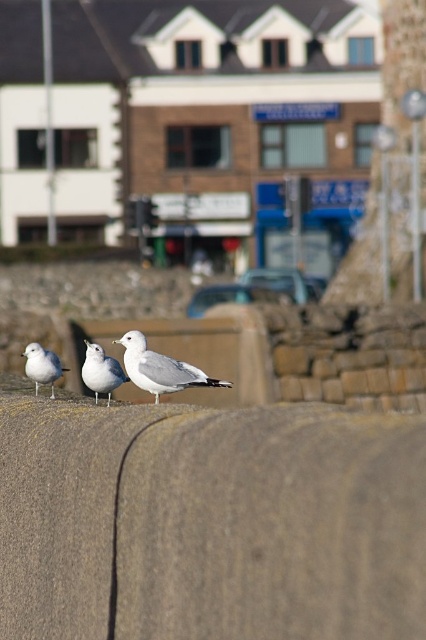
Question: Is white matte seagull at center above white matte seagull at left?

Choices:
 (A) yes
 (B) no

Answer: (A)

Question: Estimate the real-world distances between objects in this image. Which object is closer to the white matte seagull at center?

Choices:
 (A) white feathered seagull at center
 (B) white matte seagull at left

Answer: (A)

Question: Which point is closer to the camera?

Choices:
 (A) (227, 412)
 (B) (146, 388)

Answer: (A)

Question: Can you confirm if gray concrete wall at center is bigger than white feathered seagull at center?

Choices:
 (A) yes
 (B) no

Answer: (A)

Question: Which object appears closest to the camera in this image?

Choices:
 (A) white feathered seagull at center
 (B) white matte seagull at left
 (C) gray concrete wall at center

Answer: (C)

Question: Considering the relative positions of white feathered seagull at center and white matte seagull at center in the image provided, where is white feathered seagull at center located with respect to white matte seagull at center?

Choices:
 (A) right
 (B) left

Answer: (A)